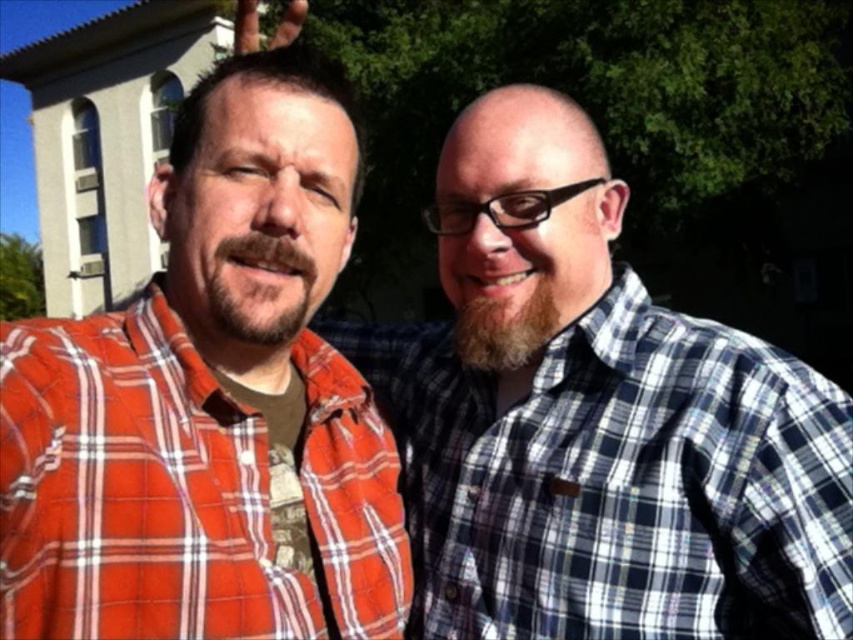
Question: Which point is closer to the camera?

Choices:
 (A) (846, 566)
 (B) (177, 120)

Answer: (A)

Question: Is plaid shirt at center in front of red plaid shirt at left?

Choices:
 (A) no
 (B) yes

Answer: (A)

Question: From the image, what is the correct spatial relationship of plaid shirt at center in relation to red plaid shirt at left?

Choices:
 (A) left
 (B) right

Answer: (B)

Question: Considering the relative positions of plaid shirt at center and red plaid shirt at left in the image provided, where is plaid shirt at center located with respect to red plaid shirt at left?

Choices:
 (A) left
 (B) right

Answer: (B)

Question: Which point is closer to the camera?

Choices:
 (A) plaid shirt at center
 (B) red plaid shirt at left

Answer: (B)